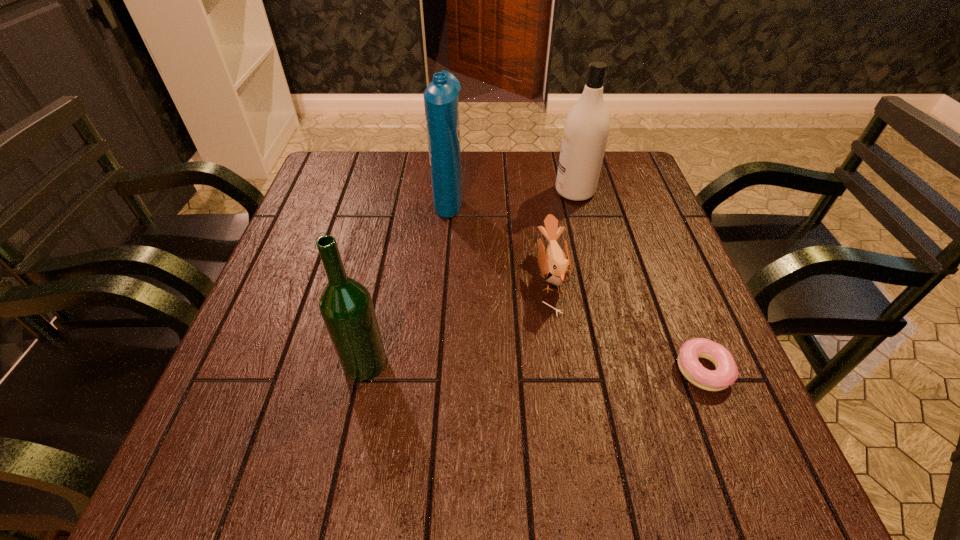
Image resolution: width=960 pixels, height=540 pixels. I want to click on the fourth object from right to left, so click(441, 100).

Where is `the fourth object from left to right`? the fourth object from left to right is located at coordinates (586, 128).

Locate an element on the screen. The image size is (960, 540). the leftmost object is located at coordinates (346, 306).

Where is `the second shortest object`? Image resolution: width=960 pixels, height=540 pixels. the second shortest object is located at coordinates (557, 267).

The image size is (960, 540). Identify the location of the third object from left to right. (557, 267).

Where is `the rightmost object`? Image resolution: width=960 pixels, height=540 pixels. the rightmost object is located at coordinates tap(726, 373).

Find the location of a particular element. Image resolution: width=960 pixels, height=540 pixels. doughnut is located at coordinates (726, 373).

Locate an element on the screen. This screenshot has width=960, height=540. vacant space situated 0.140m on the front of the fourth object from right to left is located at coordinates (444, 256).

This screenshot has height=540, width=960. I want to click on free space located 0.220m on the front-facing side of the fourth object from left to right, so click(x=474, y=192).

Find the location of a particular element. Image resolution: width=960 pixels, height=540 pixels. vacant space located 0.190m on the front-facing side of the fourth object from left to right is located at coordinates (486, 192).